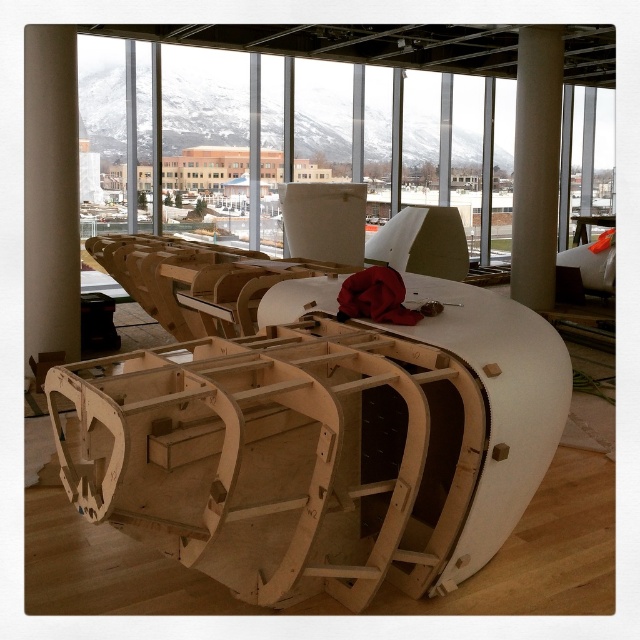
You are a delivery person carrying a 5 meter long package. You need to move it from the entrance to the storage area behind the natural wood boat at center and the white smooth column at center. Can you pass through the space between them?

The distance between the natural wood boat at center and the white smooth column at center is 5.18 meters, so yes, the 5 meter long package can pass through the space between them since the distance is slightly larger than the package.